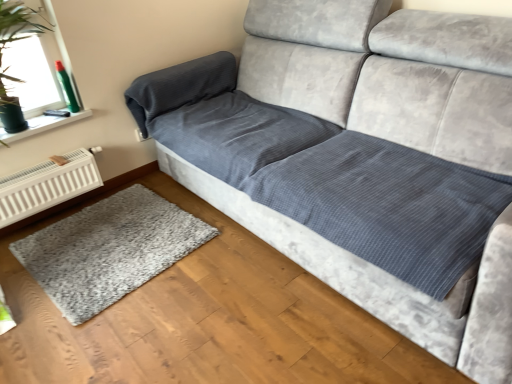
Question: Is transparent glass window at upper left touching white metallic radiator at lower left?

Choices:
 (A) no
 (B) yes

Answer: (A)

Question: Considering the relative sizes of transparent glass window at upper left and white metallic radiator at lower left in the image provided, is transparent glass window at upper left bigger than white metallic radiator at lower left?

Choices:
 (A) yes
 (B) no

Answer: (A)

Question: Would you say transparent glass window at upper left is outside white metallic radiator at lower left?

Choices:
 (A) yes
 (B) no

Answer: (A)

Question: Is transparent glass window at upper left behind white metallic radiator at lower left?

Choices:
 (A) yes
 (B) no

Answer: (B)

Question: From a real-world perspective, is transparent glass window at upper left located higher than white metallic radiator at lower left?

Choices:
 (A) yes
 (B) no

Answer: (A)

Question: Does point (93, 162) appear closer or farther from the camera than point (34, 11)?

Choices:
 (A) farther
 (B) closer

Answer: (A)

Question: Based on their positions, is white metallic radiator at lower left located to the left or right of transparent glass window at upper left?

Choices:
 (A) right
 (B) left

Answer: (A)

Question: From the image's perspective, is white metallic radiator at lower left positioned above or below transparent glass window at upper left?

Choices:
 (A) above
 (B) below

Answer: (B)

Question: Choose the correct answer: Is white metallic radiator at lower left inside transparent glass window at upper left or outside it?

Choices:
 (A) outside
 (B) inside

Answer: (A)

Question: Is transparent glass window at upper left situated inside gray shaggy rug at lower left or outside?

Choices:
 (A) outside
 (B) inside

Answer: (A)

Question: In terms of size, does transparent glass window at upper left appear bigger or smaller than gray shaggy rug at lower left?

Choices:
 (A) big
 (B) small

Answer: (A)

Question: Is transparent glass window at upper left in front of or behind gray shaggy rug at lower left in the image?

Choices:
 (A) behind
 (B) front

Answer: (A)

Question: Is point (0, 102) positioned closer to the camera than point (163, 243)?

Choices:
 (A) closer
 (B) farther

Answer: (A)

Question: Is point (80, 168) closer or farther from the camera than point (77, 307)?

Choices:
 (A) closer
 (B) farther

Answer: (B)

Question: Do you think white metallic radiator at lower left is within gray shaggy rug at lower left, or outside of it?

Choices:
 (A) outside
 (B) inside

Answer: (A)